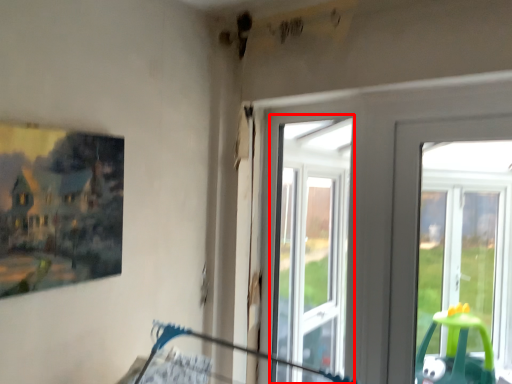
Question: Where is bay window (annotated by the red box) located in relation to picture frame in the image?

Choices:
 (A) right
 (B) left

Answer: (A)